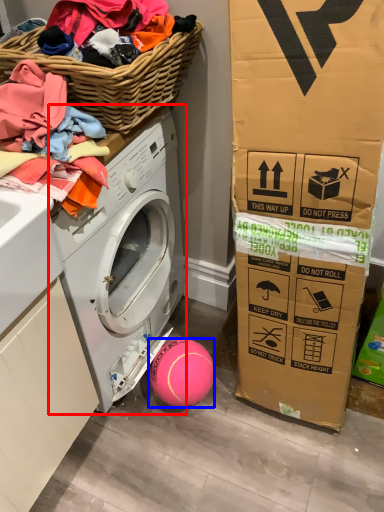
Question: Which of the following is the closest to the observer, washing machine (highlighted by a red box) or ball (highlighted by a blue box)?

Choices:
 (A) washing machine
 (B) ball

Answer: (A)